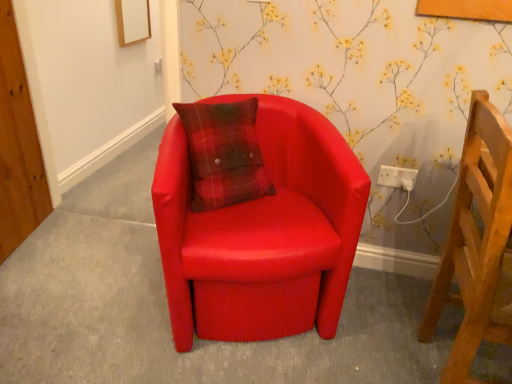
Question: Is wooden chair at right, positioned as the first chair in right-to-left order, thinner than white plastic socket at upper right?

Choices:
 (A) yes
 (B) no

Answer: (B)

Question: From the image's perspective, is wooden chair at right, which appears as the 2th chair when viewed from the left, on top of white plastic socket at upper right?

Choices:
 (A) yes
 (B) no

Answer: (B)

Question: Considering the relative sizes of wooden chair at right, positioned as the first chair in right-to-left order, and white plastic socket at upper right in the image provided, is wooden chair at right, positioned as the first chair in right-to-left order, taller than white plastic socket at upper right?

Choices:
 (A) yes
 (B) no

Answer: (A)

Question: Is wooden chair at right, which appears as the 2th chair when viewed from the left, looking in the opposite direction of white plastic socket at upper right?

Choices:
 (A) no
 (B) yes

Answer: (A)

Question: From a real-world perspective, is wooden chair at right, which appears as the 2th chair when viewed from the left, located beneath white plastic socket at upper right?

Choices:
 (A) no
 (B) yes

Answer: (A)

Question: Could you tell me if wooden chair at right, positioned as the first chair in right-to-left order, is facing white plastic socket at upper right?

Choices:
 (A) no
 (B) yes

Answer: (A)

Question: Would you say white plastic socket at upper right contains matte red armchair at center?

Choices:
 (A) yes
 (B) no

Answer: (B)

Question: From a real-world perspective, does white plastic socket at upper right stand above matte red armchair at center?

Choices:
 (A) yes
 (B) no

Answer: (A)

Question: Is white plastic socket at upper right turned away from matte red armchair at center?

Choices:
 (A) yes
 (B) no

Answer: (B)

Question: Can you confirm if white plastic socket at upper right is wider than matte red armchair at center?

Choices:
 (A) yes
 (B) no

Answer: (B)

Question: Can you confirm if white plastic socket at upper right is shorter than matte red armchair at center?

Choices:
 (A) yes
 (B) no

Answer: (B)

Question: From the image's perspective, is white plastic socket at upper right beneath matte red armchair at center?

Choices:
 (A) yes
 (B) no

Answer: (B)

Question: Is matte red armchair at center oriented towards matte leather chair at center, which ranks as the 1th chair in left-to-right order?

Choices:
 (A) no
 (B) yes

Answer: (A)